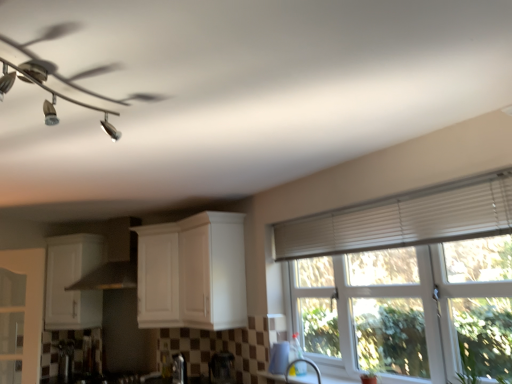
I want to click on free space above white textured blinds at upper right (from a real-world perspective), so click(380, 202).